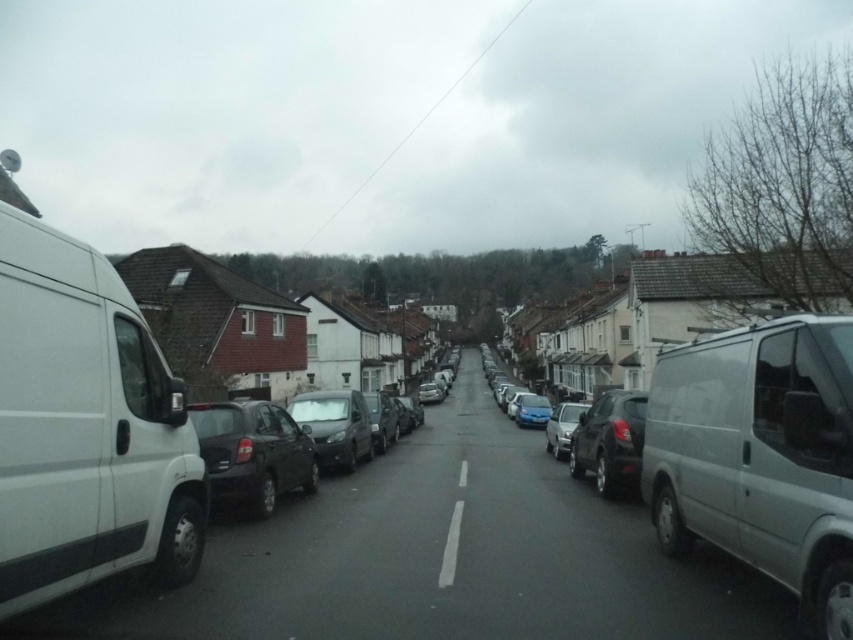
Question: Among these points, which one is nearest to the camera?

Choices:
 (A) (572, 429)
 (B) (596, 408)
 (C) (45, 332)

Answer: (C)

Question: Does matte black car at center have a greater width compared to blue metallic license plate at center?

Choices:
 (A) no
 (B) yes

Answer: (B)

Question: Does shiny black sedan at center have a smaller size compared to white solid line at center?

Choices:
 (A) yes
 (B) no

Answer: (B)

Question: Is matte black car at center to the left of blue metallic license plate at center from the viewer's perspective?

Choices:
 (A) no
 (B) yes

Answer: (B)

Question: Which of the following is the farthest from the observer?

Choices:
 (A) white matte van at left
 (B) shiny black sedan at center
 (C) matte black car at center
 (D) white matte van at right

Answer: (C)

Question: Which object is closer to the camera taking this photo?

Choices:
 (A) white solid line at center
 (B) white matte van at left

Answer: (B)